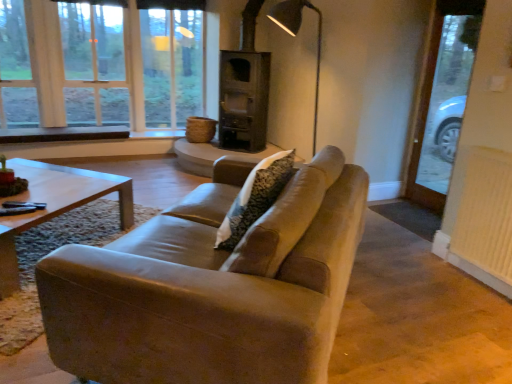
You are a GUI agent. You are given a task and a screenshot of the screen. Output one action in this format:
    pyautogui.click(x=<x>, y=<y>)
    Task: Click on the free space in front of white textured radiator at right
    Image resolution: width=512 pixels, height=384 pixels.
    Given the screenshot: What is the action you would take?
    pyautogui.click(x=482, y=304)